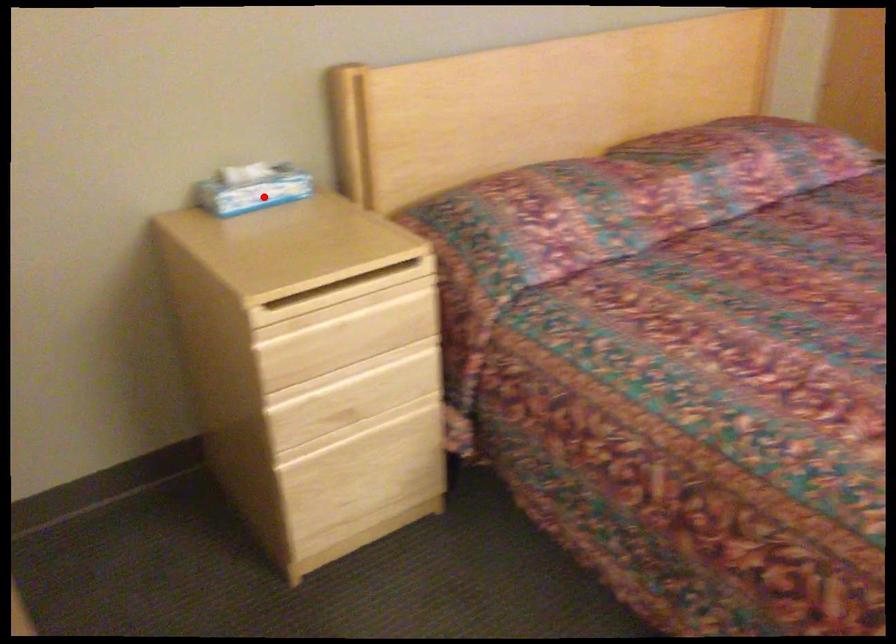
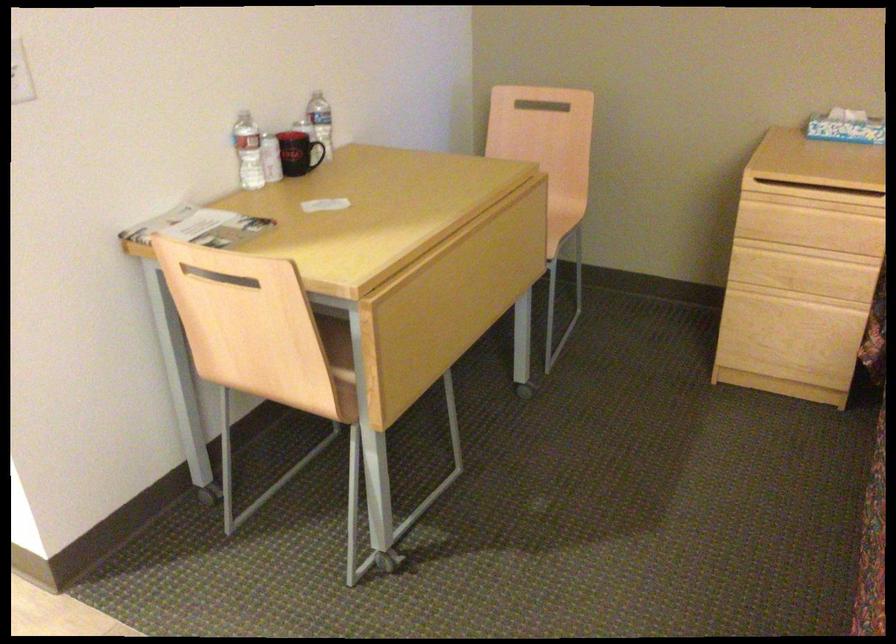
Locate, in the second image, the point that corresponds to the highlighted location in the first image.

(846, 127)